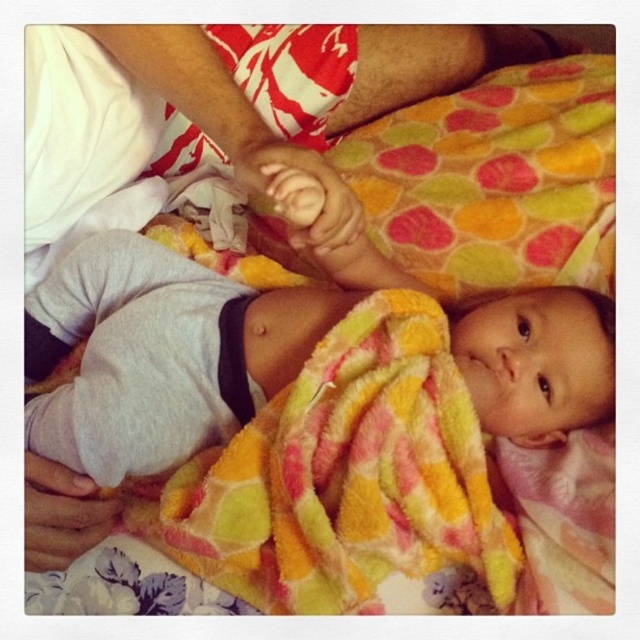
Question: Among these objects, which one is farthest from the camera?

Choices:
 (A) multicolored fleece blanket at center
 (B) white cotton leg at upper left

Answer: (B)

Question: Can you confirm if multicolored fleece blanket at center is wider than white cotton leg at upper left?

Choices:
 (A) no
 (B) yes

Answer: (A)

Question: Can you confirm if multicolored fleece blanket at center is thinner than white cotton leg at upper left?

Choices:
 (A) no
 (B) yes

Answer: (B)

Question: Which object appears farthest from the camera in this image?

Choices:
 (A) white cotton leg at upper left
 (B) multicolored fleece blanket at center

Answer: (A)

Question: Can you confirm if multicolored fleece blanket at center is positioned to the right of white cotton leg at upper left?

Choices:
 (A) no
 (B) yes

Answer: (A)

Question: Which point is closer to the camera?

Choices:
 (A) white cotton leg at upper left
 (B) multicolored fleece blanket at center

Answer: (B)